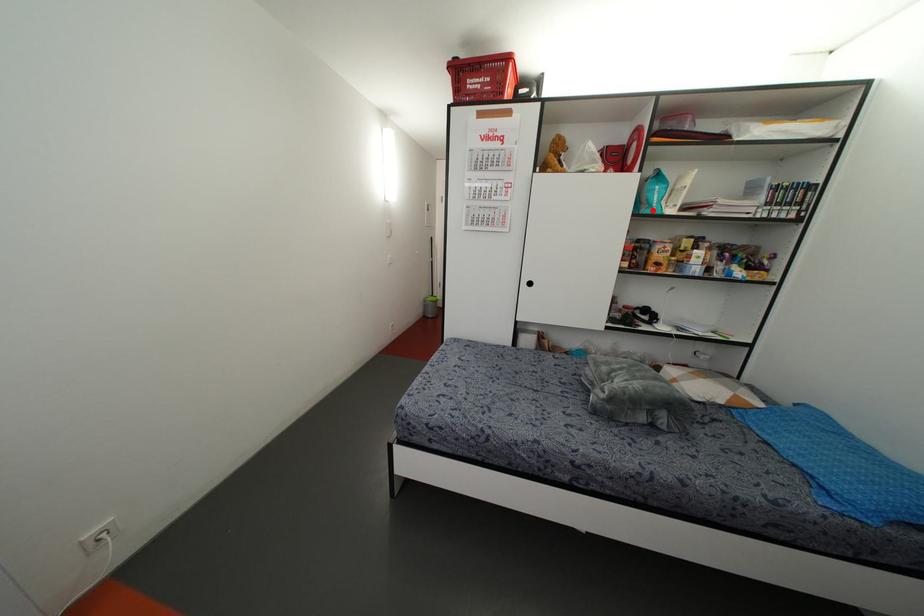
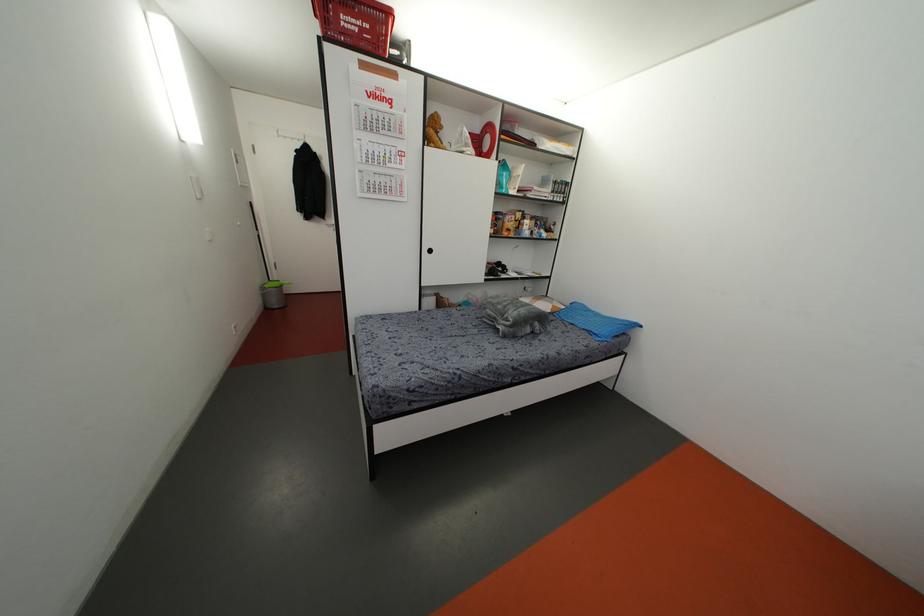
Locate, in the second image, the point that corresponds to the highlighted location in the first image.

(503, 191)